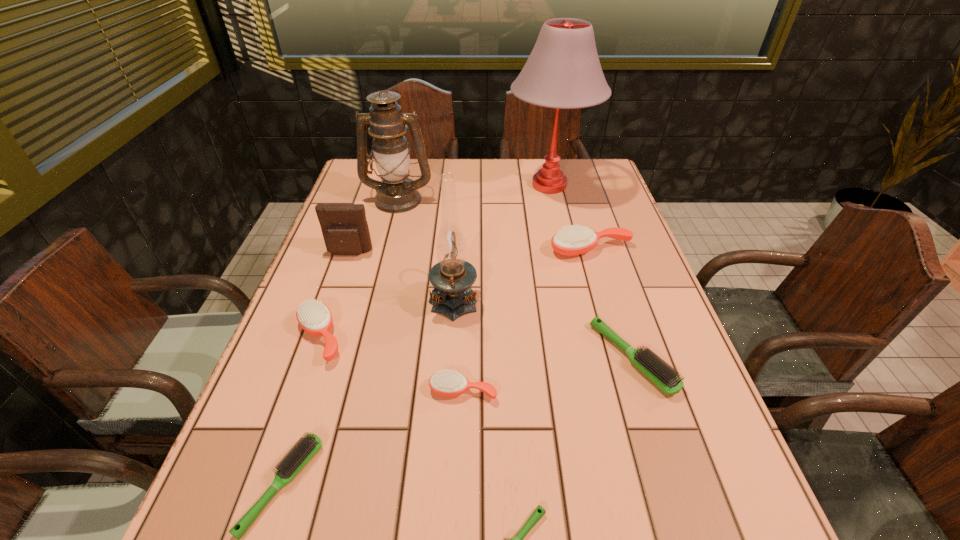
The width and height of the screenshot is (960, 540). In order to click on table lamp in this screenshot , I will do `click(563, 71)`.

Locate an element on the screen. This screenshot has width=960, height=540. the tallest object is located at coordinates (563, 71).

This screenshot has height=540, width=960. I want to click on the left oil lamp, so click(x=396, y=193).

The image size is (960, 540). I want to click on the nearer oil lamp, so click(x=453, y=276).

The width and height of the screenshot is (960, 540). In order to click on the fourth tallest object in this screenshot , I will do `click(345, 230)`.

Image resolution: width=960 pixels, height=540 pixels. I want to click on the tallest hairbrush, so click(574, 240).

The height and width of the screenshot is (540, 960). I want to click on the farthest hairbrush, so click(574, 240).

Where is `the second biggest orange hairbrush`? This screenshot has height=540, width=960. the second biggest orange hairbrush is located at coordinates (314, 317).

The height and width of the screenshot is (540, 960). What are the coordinates of `the leftmost orange hairbrush` in the screenshot? It's located at (314, 317).

I want to click on the rightmost light hairbrush, so click(659, 372).